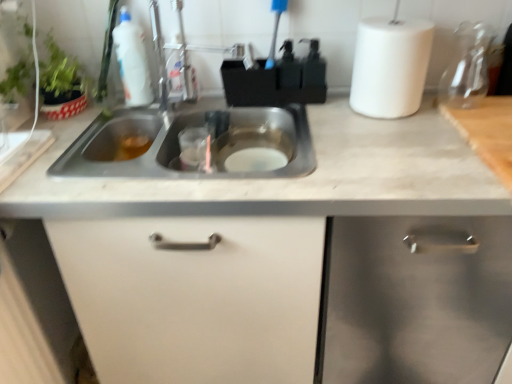
Image resolution: width=512 pixels, height=384 pixels. In order to click on vacant region in front of transparent glass carafe at upper right in this screenshot , I will do `click(474, 126)`.